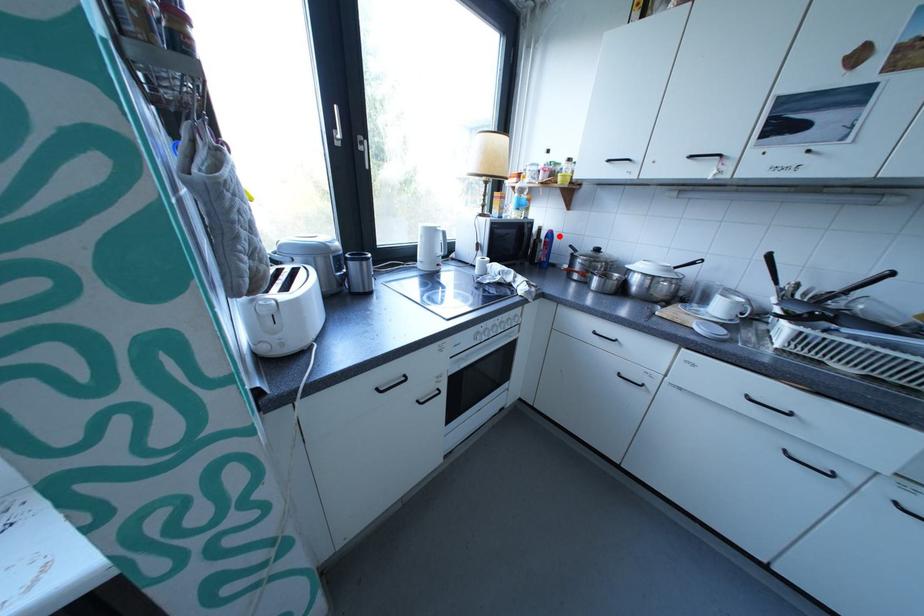
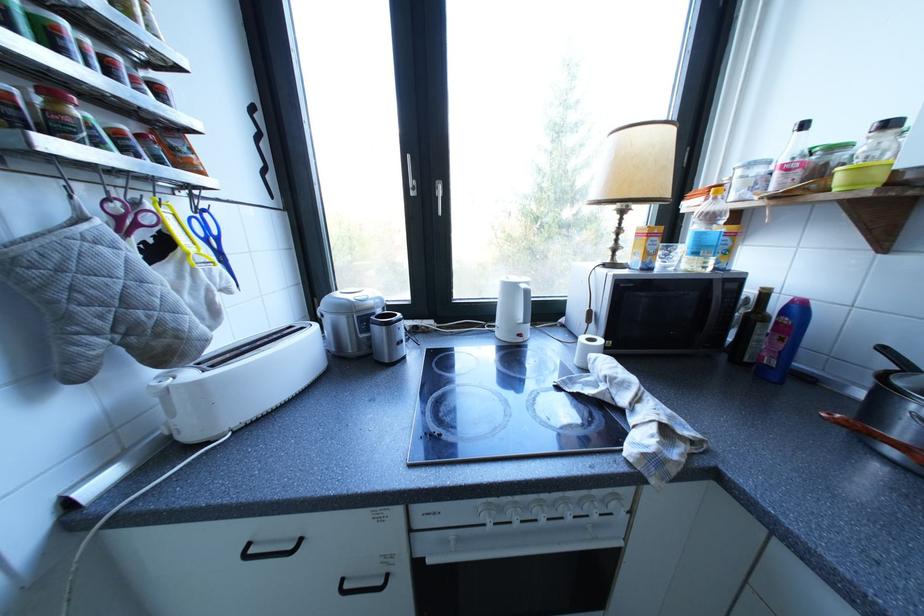
Locate, in the second image, the point that corresponds to the highlighted location in the first image.

(797, 312)